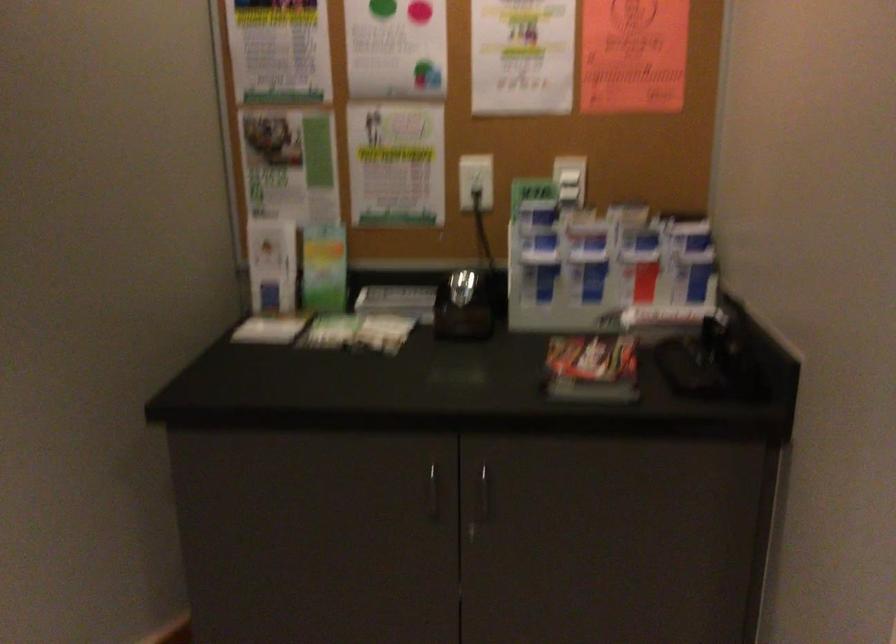
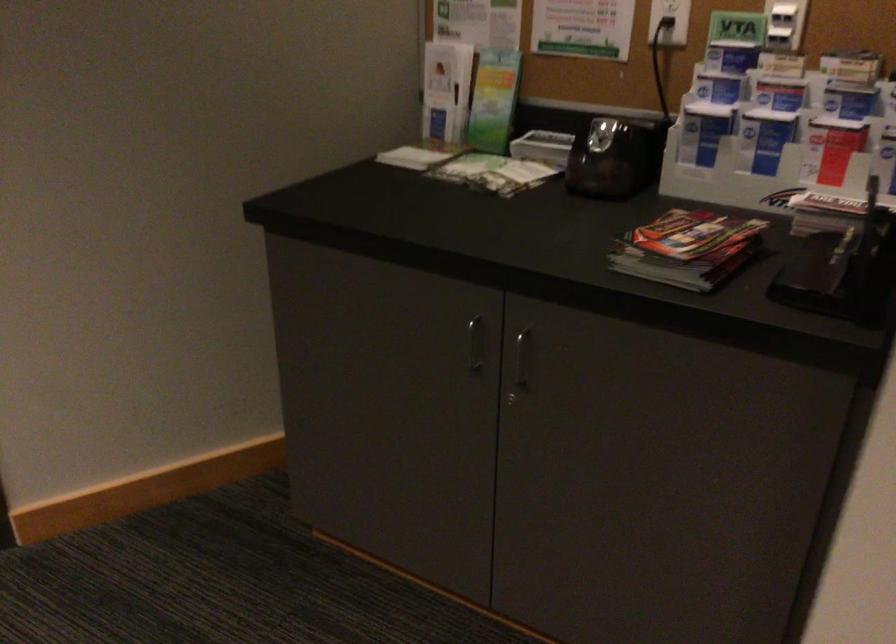
In the second image, find the point that corresponds to point (475, 304) in the first image.

(613, 158)